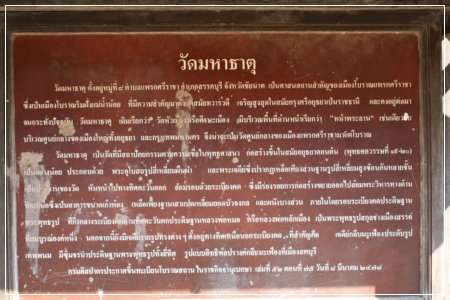
The width and height of the screenshot is (450, 300). What are the coordinates of `corner` in the screenshot? It's located at (442, 8).